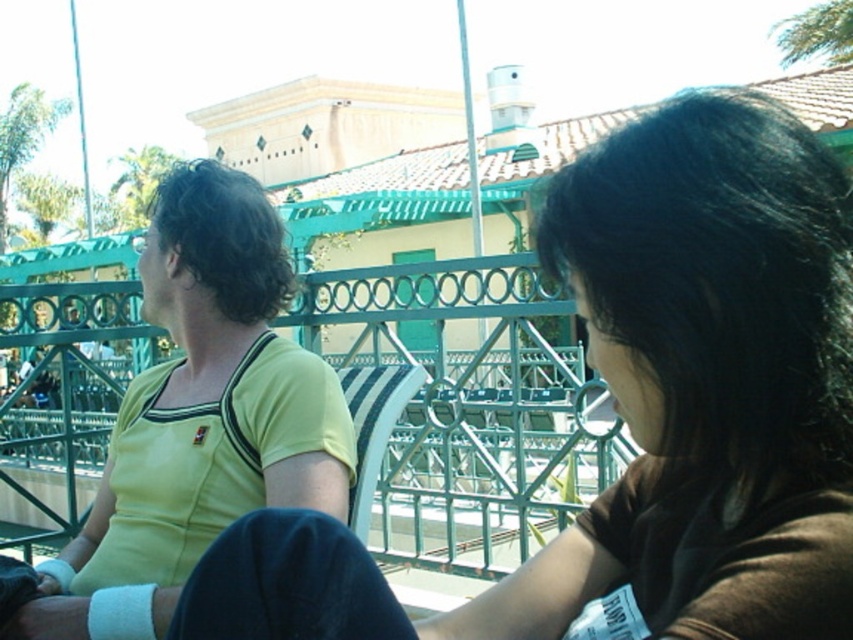
You are standing in the theme park and see the yellow matte shirt at upper left and the dark brown hair at upper right. Which object is positioned lower in the image?

The yellow matte shirt at upper left is located below dark brown hair at upper right, so the yellow matte shirt at upper left is positioned lower in the image.

You are standing at the point marked by the coordinate point at (376, 605). You want to walk towards the roller coaster track in the background. Which direction should you go?

Since the two people are 1.23 meters apart and the roller coaster track is in the background, you should walk away from the teal metal railing towards the roller coaster track direction.

Based on the photo, you are a photographer trying to capture both the dark brown hair at upper right and the yellow jersey at left in a single shot. Given that your camera can only focus on objects wider than 10 cm, will both subjects be in focus?

The dark brown hair at upper right is narrower than the yellow jersey at left. Since the camera requires objects to be wider than 10 cm to focus, we need to know the exact widths. However, the description only states the relative sizes. Without specific measurements, we cannot confirm if both meet the 10 cm requirement. Please provide more details.